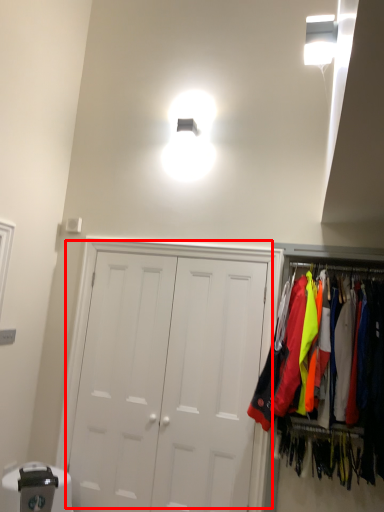
Question: From the image's perspective, where is door (annotated by the red box) located relative to closet?

Choices:
 (A) below
 (B) above

Answer: (A)